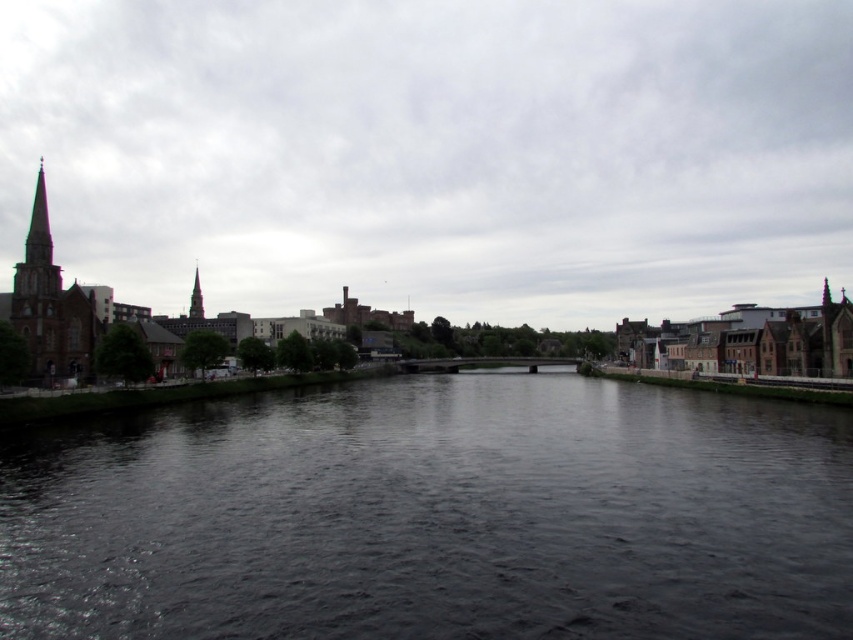
Can you confirm if dark water at center is thinner than smooth gray spire at center-left?

Incorrect, dark water at center's width is not less than smooth gray spire at center-left's.

Who is more forward, (672,570) or (202,317)?

Positioned in front is point (672,570).

Find the location of a particular element. dark water at center is located at coordinates (433, 515).

Who is positioned more to the right, cloudy sky at upper center or smooth gray spire at center-left?

From the viewer's perspective, cloudy sky at upper center appears more on the right side.

Which is above, cloudy sky at upper center or smooth gray spire at center-left?

cloudy sky at upper center is above.

What do you see at coordinates (434, 154) in the screenshot?
I see `cloudy sky at upper center` at bounding box center [434, 154].

In order to click on cloudy sky at upper center in this screenshot , I will do `click(434, 154)`.

Between cloudy sky at upper center and dark water at center, which one appears on the right side from the viewer's perspective?

Positioned to the right is dark water at center.

Is cloudy sky at upper center further to camera compared to dark water at center?

Yes, cloudy sky at upper center is further from the viewer.

Find the location of a particular element. The image size is (853, 640). cloudy sky at upper center is located at coordinates (434, 154).